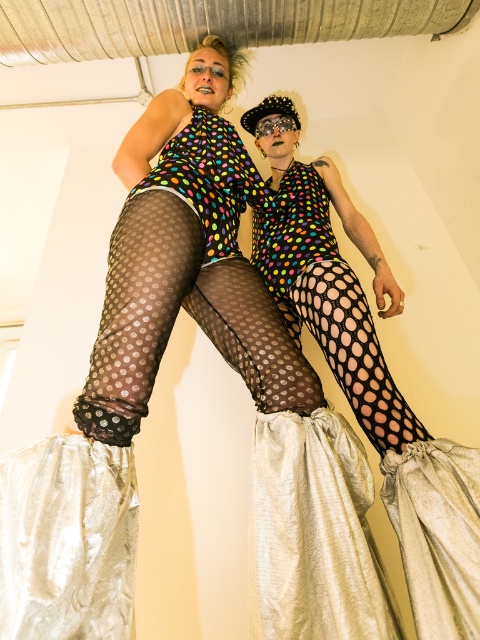
Between polka dot fabric at center and fishnet tights at center, which one has more height?

Standing taller between the two is polka dot fabric at center.

Based on the photo, which is below, polka dot fabric at center or fishnet tights at center?

fishnet tights at center is lower down.

Is point (294, 336) positioned before point (240, 365)?

No, (294, 336) is behind (240, 365).

Locate an element on the screen. The width and height of the screenshot is (480, 640). polka dot fabric at center is located at coordinates (369, 372).